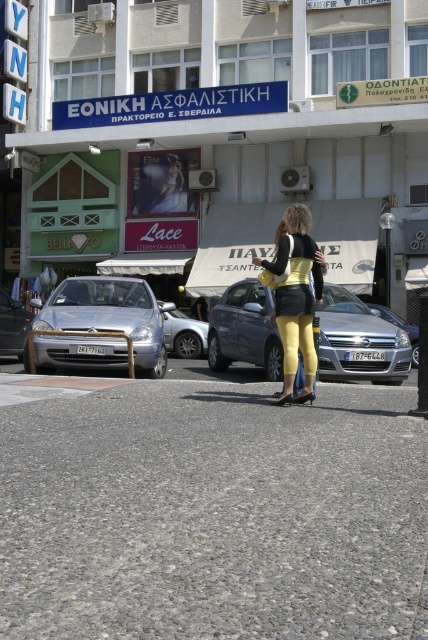
You are a photographer standing at the edge of the cobblestone street in the scene. You want to capture a closeup shot of the yellow matte leggings at center without moving closer than 8 meters. Can you achieve this? Please explain.

The yellow matte leggings at center is 8.70 meters away from viewer. Since the minimum distance you can move is 8 meters, which is closer than the current distance of 8.70 meters, you cannot move closer to take the photo. Therefore, you cannot achieve the closeup shot without moving closer than 8 meters.

You are standing at the point with coordinates point (306, 364) and want to walk to the point with coordinates point (157, 356). Given the street scene described, will you be moving towards the foreground or the background of the image?

You will be moving towards the foreground of the image because point (157, 356) is behind point (306, 364), so moving from point (306, 364) to point (157, 356) means you are going towards the foreground.